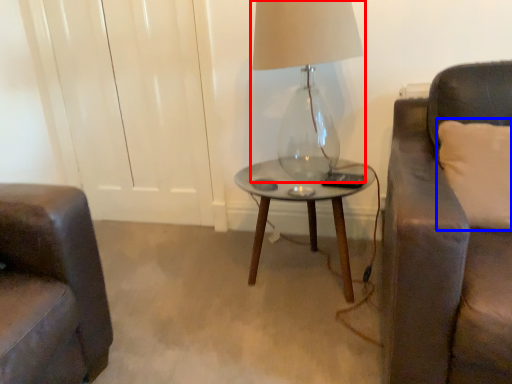
Question: Among these objects, which one is nearest to the camera, lamp (highlighted by a red box) or pillow (highlighted by a blue box)?

Choices:
 (A) lamp
 (B) pillow

Answer: (B)